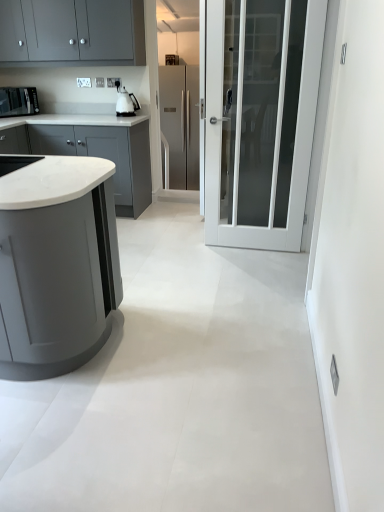
Where is `white glossy kettle at upper center, which is the 2th kitchen appliance from left to right`? Image resolution: width=384 pixels, height=512 pixels. white glossy kettle at upper center, which is the 2th kitchen appliance from left to right is located at coordinates (126, 102).

You are a GUI agent. You are given a task and a screenshot of the screen. Output one action in this format:
    pyautogui.click(x=<x>, y=<y>)
    Task: Click on the white marble countertop at left, which is counted as the second cabinetry, starting from the top
    
    Given the screenshot: What is the action you would take?
    pyautogui.click(x=90, y=149)

This screenshot has width=384, height=512. What do you see at coordinates (260, 119) in the screenshot? I see `white glass door at center` at bounding box center [260, 119].

I want to click on matte gray cabinet at left, which appears as the 1th cabinetry when ordered from the bottom, so click(x=55, y=263).

Considering the sizes of objects matte gray cabinets at upper left, placed as the first cabinetry when sorted from top to bottom, and white glossy kettle at upper center, the 1th kitchen appliance in the right-to-left sequence, in the image provided, who is smaller, matte gray cabinets at upper left, placed as the first cabinetry when sorted from top to bottom, or white glossy kettle at upper center, the 1th kitchen appliance in the right-to-left sequence,?

Smaller between the two is white glossy kettle at upper center, the 1th kitchen appliance in the right-to-left sequence.

Is matte gray cabinets at upper left, the third cabinetry positioned from the bottom, positioned in front of white glossy kettle at upper center, the 1th kitchen appliance in the right-to-left sequence?

Yes, matte gray cabinets at upper left, the third cabinetry positioned from the bottom, is closer to the camera.

From the image's perspective, is matte gray cabinets at upper left, which appears as the 2th cabinetry when viewed from the back, above white glossy kettle at upper center, which is the 2th kitchen appliance from left to right?

Yes, from the image's perspective, matte gray cabinets at upper left, which appears as the 2th cabinetry when viewed from the back, is over white glossy kettle at upper center, which is the 2th kitchen appliance from left to right.

From their relative heights in the image, would you say matte gray cabinets at upper left, the third cabinetry positioned from the bottom, is taller or shorter than white glossy kettle at upper center, which is the 2th kitchen appliance from left to right?

Clearly, matte gray cabinets at upper left, the third cabinetry positioned from the bottom, is taller compared to white glossy kettle at upper center, which is the 2th kitchen appliance from left to right.

Does point (18, 106) come in front of point (257, 226)?

No.

In the scene shown: From the image's perspective, which object appears higher, matte black microwave at upper left, placed as the 1th kitchen appliance when sorted from left to right, or white glass door at center?

matte black microwave at upper left, placed as the 1th kitchen appliance when sorted from left to right, from the image's perspective.

Could you tell me if matte black microwave at upper left, placed as the second kitchen appliance when sorted from right to left, is facing white glass door at center?

Yes, matte black microwave at upper left, placed as the second kitchen appliance when sorted from right to left, is turned towards white glass door at center.

Looking at their sizes, would you say matte black microwave at upper left, placed as the 1th kitchen appliance when sorted from left to right, is wider or thinner than white glass door at center?

matte black microwave at upper left, placed as the 1th kitchen appliance when sorted from left to right, is wider than white glass door at center.

Does matte gray cabinets at upper left, which appears as the 2th cabinetry when viewed from the back, appear on the right side of stainless steel refrigerator at center?

Incorrect, matte gray cabinets at upper left, which appears as the 2th cabinetry when viewed from the back, is not on the right side of stainless steel refrigerator at center.

From the picture: Is the position of matte gray cabinets at upper left, placed as the first cabinetry when sorted from top to bottom, more distant than that of stainless steel refrigerator at center?

No, matte gray cabinets at upper left, placed as the first cabinetry when sorted from top to bottom, is closer to the viewer.

Does matte gray cabinets at upper left, which appears as the 2th cabinetry when viewed from the back, have a lesser height compared to stainless steel refrigerator at center?

Correct, matte gray cabinets at upper left, which appears as the 2th cabinetry when viewed from the back, is not as tall as stainless steel refrigerator at center.

From a real-world perspective, is matte gray cabinets at upper left, placed as the first cabinetry when sorted from top to bottom, below stainless steel refrigerator at center?

No, from a real-world perspective, matte gray cabinets at upper left, placed as the first cabinetry when sorted from top to bottom, is not beneath stainless steel refrigerator at center.

How different are the orientations of white marble countertop at left, which is counted as the second cabinetry, starting from the top, and stainless steel refrigerator at center in degrees?

white marble countertop at left, which is counted as the second cabinetry, starting from the top, and stainless steel refrigerator at center are facing 0.6 degrees away from each other.

Could you tell me if white marble countertop at left, which is counted as the 3th cabinetry, starting from the front, is facing stainless steel refrigerator at center?

No.

Does white marble countertop at left, which is the 2th cabinetry in bottom-to-top order, appear on the right side of stainless steel refrigerator at center?

In fact, white marble countertop at left, which is the 2th cabinetry in bottom-to-top order, is to the left of stainless steel refrigerator at center.

In terms of width, does white marble countertop at left, which is the 2th cabinetry in bottom-to-top order, look wider or thinner when compared to stainless steel refrigerator at center?

Considering their sizes, white marble countertop at left, which is the 2th cabinetry in bottom-to-top order, looks slimmer than stainless steel refrigerator at center.

Is matte gray cabinet at left, the 3th cabinetry viewed from the back, in front of or behind stainless steel refrigerator at center in the image?

Visually, matte gray cabinet at left, the 3th cabinetry viewed from the back, is located in front of stainless steel refrigerator at center.

Is matte gray cabinet at left, which appears as the 1th cabinetry when ordered from the bottom, taller than stainless steel refrigerator at center?

No.

In order to click on cabinetry that is the 1st object above the stainless steel refrigerator at center (from a real-world perspective) in this screenshot , I will do `click(55, 263)`.

From a real-world perspective, is matte gray cabinet at left, which appears as the 1th cabinetry when ordered from the bottom, on top of stainless steel refrigerator at center?

Yes, from a real-world perspective, matte gray cabinet at left, which appears as the 1th cabinetry when ordered from the bottom, is over stainless steel refrigerator at center

Considering the positions of points (130, 20) and (280, 218), is point (130, 20) closer to camera compared to point (280, 218)?

That is False.

Is matte gray cabinets at upper left, which appears as the 2th cabinetry when viewed from the back, facing away from white glass door at center?

No, matte gray cabinets at upper left, which appears as the 2th cabinetry when viewed from the back, is not facing away from white glass door at center.

Measure the distance between matte gray cabinets at upper left, positioned as the second cabinetry in front-to-back order, and white glass door at center.

matte gray cabinets at upper left, positioned as the second cabinetry in front-to-back order, is 1.43 meters away from white glass door at center.

Can you tell me how much matte gray cabinets at upper left, placed as the first cabinetry when sorted from top to bottom, and white glass door at center differ in facing direction?

The facing directions of matte gray cabinets at upper left, placed as the first cabinetry when sorted from top to bottom, and white glass door at center are 1.81 degrees apart.

Can you tell me how much white marble countertop at left, which is the 2th cabinetry in bottom-to-top order, and matte gray cabinets at upper left, which appears as the 2th cabinetry when viewed from the back, differ in facing direction?

white marble countertop at left, which is the 2th cabinetry in bottom-to-top order, and matte gray cabinets at upper left, which appears as the 2th cabinetry when viewed from the back, are facing 0.00024 degrees away from each other.

Do you think white marble countertop at left, acting as the first cabinetry starting from the back, is within matte gray cabinets at upper left, the third cabinetry positioned from the bottom, or outside of it?

white marble countertop at left, acting as the first cabinetry starting from the back, is not enclosed by matte gray cabinets at upper left, the third cabinetry positioned from the bottom.

Considering the sizes of white marble countertop at left, which is counted as the 3th cabinetry, starting from the front, and matte gray cabinets at upper left, positioned as the second cabinetry in front-to-back order, in the image, is white marble countertop at left, which is counted as the 3th cabinetry, starting from the front, taller or shorter than matte gray cabinets at upper left, positioned as the second cabinetry in front-to-back order,?

Clearly, white marble countertop at left, which is counted as the 3th cabinetry, starting from the front, is taller compared to matte gray cabinets at upper left, positioned as the second cabinetry in front-to-back order.

From a real-world perspective, which object rests below the other?

white marble countertop at left, acting as the first cabinetry starting from the back, is physically lower.

The width and height of the screenshot is (384, 512). I want to click on the 2nd kitchen appliance positioned below the matte gray cabinets at upper left, positioned as the second cabinetry in front-to-back order (from a real-world perspective), so click(x=126, y=102).

Find the location of a particular element. The image size is (384, 512). door below the matte black microwave at upper left, placed as the second kitchen appliance when sorted from right to left (from the image's perspective) is located at coordinates (260, 119).

Looking at the image, which one is located closer to matte gray cabinet at left, the 3th cabinetry viewed from the back, white marble countertop at left, which is the 2th cabinetry in bottom-to-top order, or stainless steel refrigerator at center?

white marble countertop at left, which is the 2th cabinetry in bottom-to-top order.

From the image, which object appears to be farther from white glass door at center, matte gray cabinets at upper left, which appears as the 2th cabinetry when viewed from the back, or white marble countertop at left, which is the 2th cabinetry in bottom-to-top order?

matte gray cabinets at upper left, which appears as the 2th cabinetry when viewed from the back, is positioned further to the anchor white glass door at center.

Which object lies nearer to the anchor point matte gray cabinets at upper left, the third cabinetry positioned from the bottom, white glossy kettle at upper center, the 1th kitchen appliance in the right-to-left sequence, or matte gray cabinet at left, which is the third cabinetry from top to bottom?

white glossy kettle at upper center, the 1th kitchen appliance in the right-to-left sequence.

From the picture: Which object lies further to the anchor point white glass door at center, matte black microwave at upper left, placed as the second kitchen appliance when sorted from right to left, or stainless steel refrigerator at center?

matte black microwave at upper left, placed as the second kitchen appliance when sorted from right to left.

Based on their spatial positions, is white glass door at center or matte gray cabinet at left, which appears as the 1th cabinetry when ordered from the bottom, further from matte gray cabinets at upper left, positioned as the second cabinetry in front-to-back order?

matte gray cabinet at left, which appears as the 1th cabinetry when ordered from the bottom, is further to matte gray cabinets at upper left, positioned as the second cabinetry in front-to-back order.

Looking at the image, which one is located further to white marble countertop at left, which is counted as the 3th cabinetry, starting from the front, stainless steel refrigerator at center or matte black microwave at upper left, placed as the second kitchen appliance when sorted from right to left?

Among the two, stainless steel refrigerator at center is located further to white marble countertop at left, which is counted as the 3th cabinetry, starting from the front.

Based on their spatial positions, is white glass door at center or matte black microwave at upper left, placed as the 1th kitchen appliance when sorted from left to right, further from white glossy kettle at upper center, the 1th kitchen appliance in the right-to-left sequence?

white glass door at center is positioned further to the anchor white glossy kettle at upper center, the 1th kitchen appliance in the right-to-left sequence.

Based on their spatial positions, is white glossy kettle at upper center, which is the 2th kitchen appliance from left to right, or white glass door at center closer to stainless steel refrigerator at center?

white glossy kettle at upper center, which is the 2th kitchen appliance from left to right, is positioned closer to the anchor stainless steel refrigerator at center.

Where is `door located between matte gray cabinet at left, which is the third cabinetry from top to bottom, and matte black microwave at upper left, placed as the 1th kitchen appliance when sorted from left to right, in the depth direction`? This screenshot has width=384, height=512. door located between matte gray cabinet at left, which is the third cabinetry from top to bottom, and matte black microwave at upper left, placed as the 1th kitchen appliance when sorted from left to right, in the depth direction is located at coordinates click(260, 119).

Image resolution: width=384 pixels, height=512 pixels. What are the coordinates of `door that lies between matte gray cabinets at upper left, which appears as the 2th cabinetry when viewed from the back, and matte gray cabinet at left, which appears as the 1th cabinetry when ordered from the bottom, from top to bottom` in the screenshot? It's located at (260, 119).

You are a GUI agent. You are given a task and a screenshot of the screen. Output one action in this format:
    pyautogui.click(x=<x>, y=<y>)
    Task: Click on the door between matte gray cabinet at left, which appears as the 1th cabinetry when viewed from the front, and stainless steel refrigerator at center from front to back
    
    Given the screenshot: What is the action you would take?
    pyautogui.click(x=260, y=119)

Where is `cabinetry positioned between matte gray cabinets at upper left, positioned as the second cabinetry in front-to-back order, and stainless steel refrigerator at center from near to far`? cabinetry positioned between matte gray cabinets at upper left, positioned as the second cabinetry in front-to-back order, and stainless steel refrigerator at center from near to far is located at coordinates (90, 149).